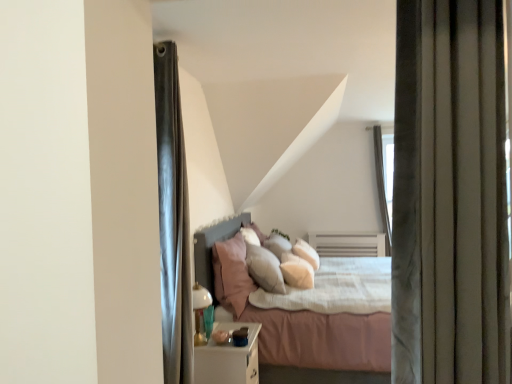
Question: Considering the relative positions of pink fabric pillow at center, the 2th pillow when ordered from right to left, and soft white pillow at center, the first pillow positioned from the right, in the image provided, is pink fabric pillow at center, the 2th pillow when ordered from right to left, in front of soft white pillow at center, the first pillow positioned from the right,?

Choices:
 (A) no
 (B) yes

Answer: (B)

Question: Does pink fabric pillow at center, the first pillow positioned from the left, have a greater width compared to soft white pillow at center, arranged as the 2th pillow when viewed from the left?

Choices:
 (A) no
 (B) yes

Answer: (A)

Question: Is pink fabric pillow at center, the first pillow positioned from the left, bigger than soft white pillow at center, the first pillow positioned from the right?

Choices:
 (A) yes
 (B) no

Answer: (B)

Question: Does pink fabric pillow at center, the 2th pillow when ordered from right to left, appear on the right side of soft white pillow at center, the first pillow positioned from the right?

Choices:
 (A) yes
 (B) no

Answer: (B)

Question: Considering the relative positions of pink fabric pillow at center, the 2th pillow when ordered from right to left, and soft white pillow at center, arranged as the 2th pillow when viewed from the left, in the image provided, is pink fabric pillow at center, the 2th pillow when ordered from right to left, behind soft white pillow at center, arranged as the 2th pillow when viewed from the left,?

Choices:
 (A) no
 (B) yes

Answer: (A)

Question: Relative to transparent glass door at upper right, is soft pink fabric bed at center in front or behind?

Choices:
 (A) front
 (B) behind

Answer: (A)

Question: In the image, is soft pink fabric bed at center on the left side or the right side of transparent glass door at upper right?

Choices:
 (A) left
 (B) right

Answer: (A)

Question: From the image's perspective, is soft pink fabric bed at center positioned above or below transparent glass door at upper right?

Choices:
 (A) above
 (B) below

Answer: (B)

Question: Based on their sizes in the image, would you say soft pink fabric bed at center is bigger or smaller than transparent glass door at upper right?

Choices:
 (A) small
 (B) big

Answer: (B)

Question: Is point (223, 367) positioned closer to the camera than point (286, 264)?

Choices:
 (A) closer
 (B) farther

Answer: (A)

Question: Considering their positions, is white glossy nightstand at lower center located in front of or behind soft white pillow at center, the first pillow positioned from the right?

Choices:
 (A) behind
 (B) front

Answer: (B)

Question: In terms of size, does white glossy nightstand at lower center appear bigger or smaller than soft white pillow at center, the first pillow positioned from the right?

Choices:
 (A) small
 (B) big

Answer: (A)

Question: Choose the correct answer: Is white glossy nightstand at lower center inside soft white pillow at center, arranged as the 2th pillow when viewed from the left, or outside it?

Choices:
 (A) inside
 (B) outside

Answer: (B)

Question: In terms of width, does soft white pillow at center, the first pillow positioned from the right, look wider or thinner when compared to soft pink fabric bed at center?

Choices:
 (A) thin
 (B) wide

Answer: (A)

Question: From the image's perspective, relative to soft pink fabric bed at center, is soft white pillow at center, the first pillow positioned from the right, above or below?

Choices:
 (A) above
 (B) below

Answer: (A)